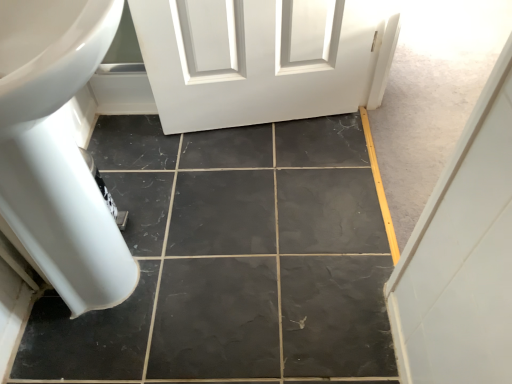
The image size is (512, 384). I want to click on vacant area on top of black marble tile at center (from a real-world perspective), so click(x=251, y=207).